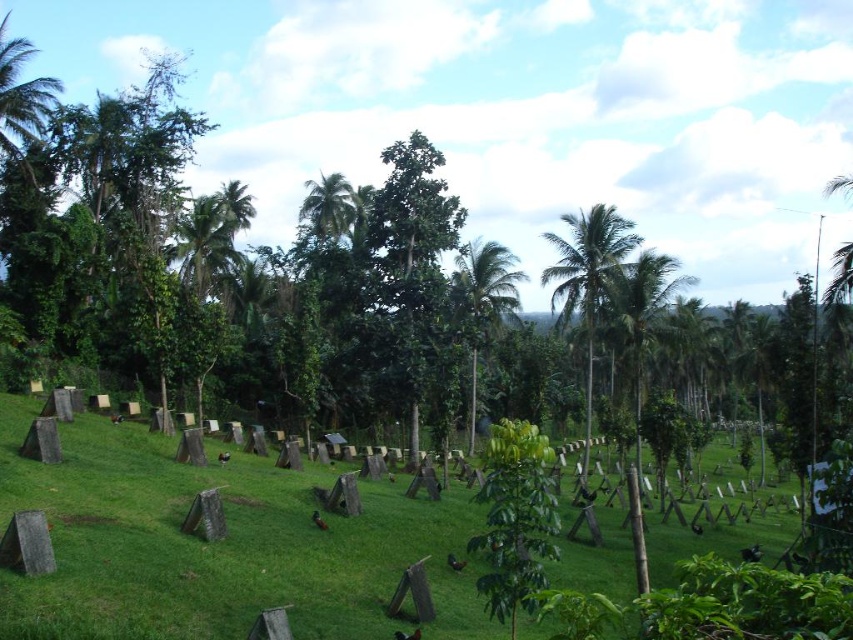
Question: Among these points, which one is nearest to the camera?

Choices:
 (A) (587, 358)
 (B) (473, 419)
 (C) (242, 589)

Answer: (C)

Question: Which point is closer to the camera taking this photo?

Choices:
 (A) (473, 618)
 (B) (584, 214)

Answer: (A)

Question: Which object is the farthest from the green leafy palm tree at center-right?

Choices:
 (A) green leafy palm tree at center
 (B) green grass at center

Answer: (B)

Question: Is green grass at center above green leafy palm tree at center?

Choices:
 (A) no
 (B) yes

Answer: (A)

Question: Can you confirm if green grass at center is positioned to the right of green leafy palm tree at center?

Choices:
 (A) no
 (B) yes

Answer: (A)

Question: Does green leafy palm tree at center-right have a larger size compared to green leafy palm tree at center?

Choices:
 (A) yes
 (B) no

Answer: (A)